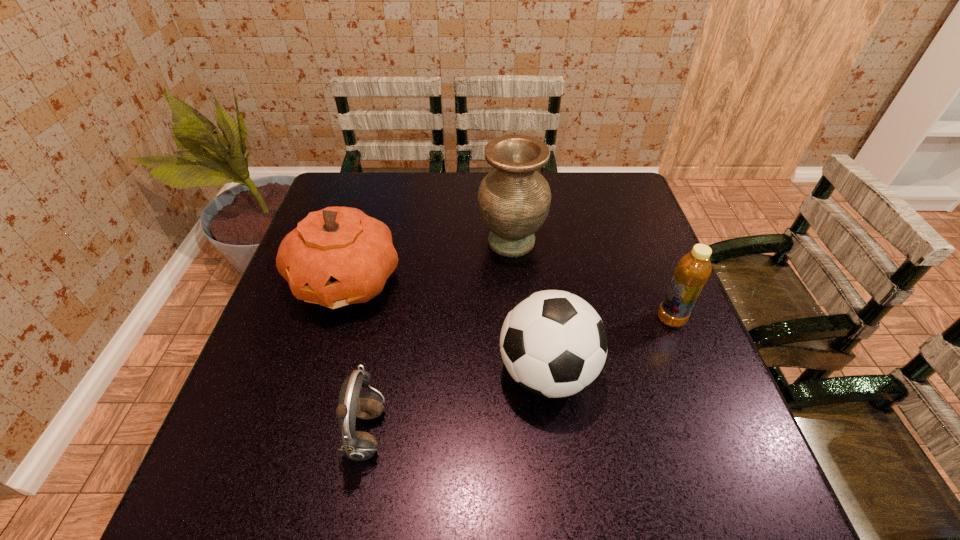
Find the location of a particular element. the tallest object is located at coordinates (514, 200).

This screenshot has width=960, height=540. I want to click on pumpkin, so click(x=338, y=256).

Locate an element on the screen. This screenshot has width=960, height=540. the rightmost object is located at coordinates (693, 270).

Identify the location of soccer ball. (553, 343).

In order to click on the shortest object in this screenshot , I will do `click(356, 445)`.

You are a GUI agent. You are given a task and a screenshot of the screen. Output one action in this format:
    pyautogui.click(x=<x>, y=<y>)
    Task: Click on the vacant point located 0.240m on the left of the vase
    
    Given the screenshot: What is the action you would take?
    pyautogui.click(x=392, y=242)

Identify the location of vacant space located 0.130m on the front-facing side of the pumpkin. (319, 373).

This screenshot has height=540, width=960. Identify the location of free space located on the left of the bottle. (x=502, y=319).

In order to click on vacant space situated on the front of the soccer ball in this screenshot , I will do `click(564, 507)`.

The height and width of the screenshot is (540, 960). Identify the location of vacant space located on the ear pads of the shortest object. (495, 435).